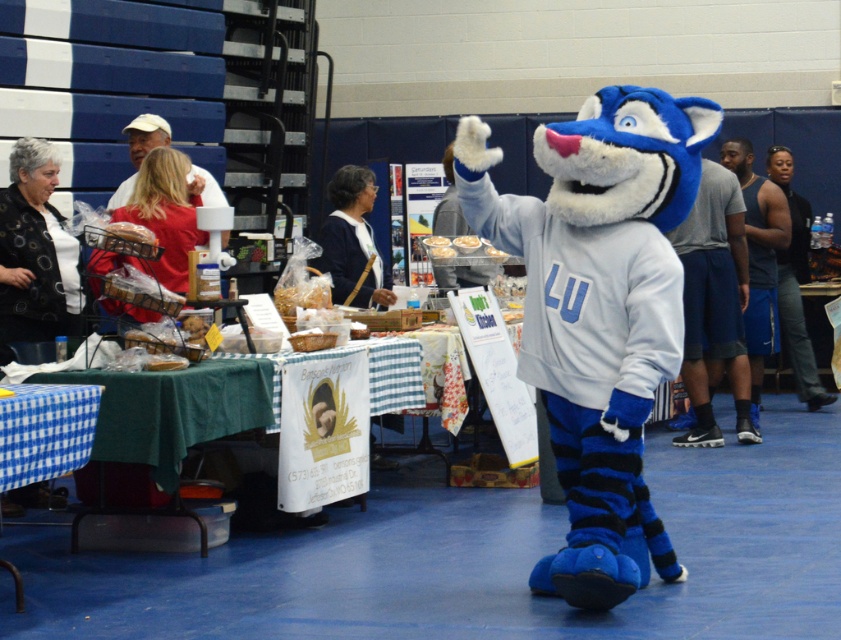
Question: Which of the following is the farthest from the observer?

Choices:
 (A) (429, 252)
 (B) (125, 198)

Answer: (A)

Question: Which point is closer to the camera?

Choices:
 (A) (152, 266)
 (B) (791, 216)
 (C) (742, 348)
 (D) (11, 467)

Answer: (D)

Question: From the image, what is the correct spatial relationship of navy blue sweater at center in relation to red shirt at upper left?

Choices:
 (A) below
 (B) above

Answer: (A)

Question: Which point appears closest to the camera in this image?

Choices:
 (A) (800, 256)
 (B) (24, 154)
 (C) (225, 204)

Answer: (B)

Question: Is green checkered tablecloth at lower left below white fluffy bread at center?

Choices:
 (A) yes
 (B) no

Answer: (A)

Question: Is white dotted vest at upper left above dark blue shorts at right?

Choices:
 (A) yes
 (B) no

Answer: (A)